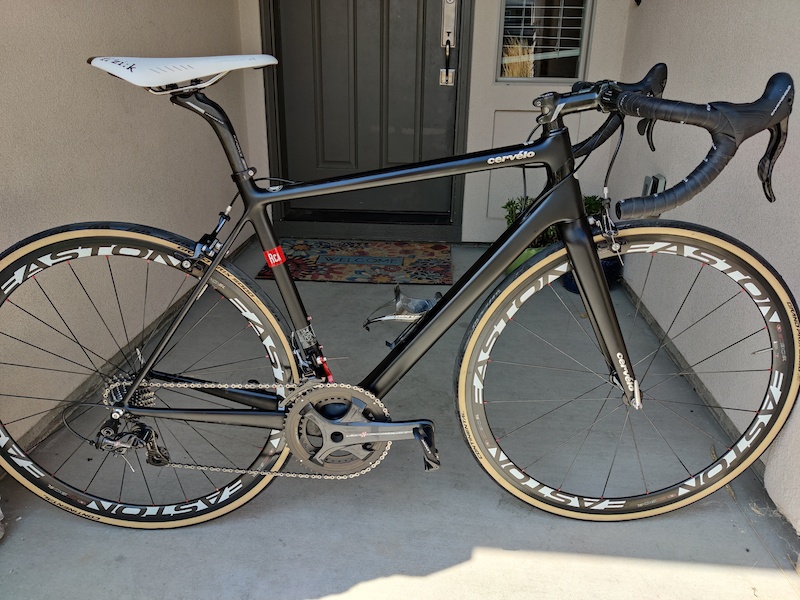
Locate an element on the screen. This screenshot has height=600, width=800. wall is located at coordinates (58, 66), (749, 47).